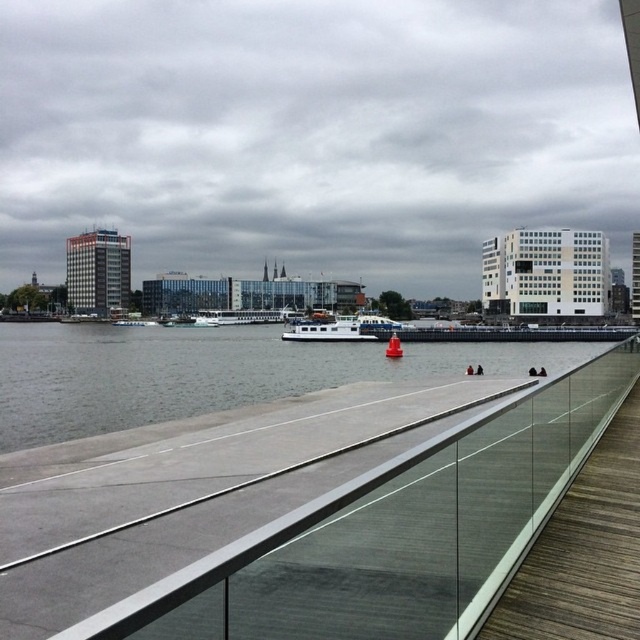
Question: Is gray concrete river at center to the left of white matte boat at center from the viewer's perspective?

Choices:
 (A) yes
 (B) no

Answer: (A)

Question: Among these objects, which one is farthest from the camera?

Choices:
 (A) white matte boat at center
 (B) gray concrete river at center

Answer: (A)

Question: Does gray concrete river at center come behind white matte boat at center?

Choices:
 (A) no
 (B) yes

Answer: (A)

Question: Is gray concrete river at center smaller than white matte boat at center?

Choices:
 (A) no
 (B) yes

Answer: (A)